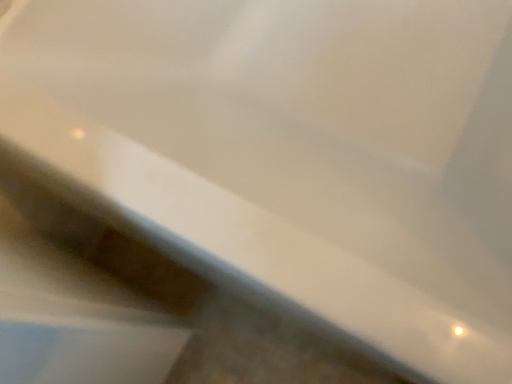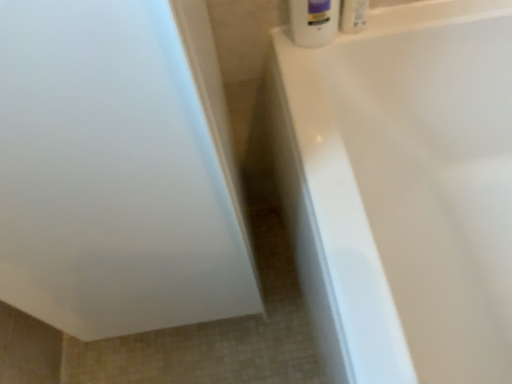
Question: Which way did the camera rotate in the video?

Choices:
 (A) rotated upward
 (B) rotated downward

Answer: (A)